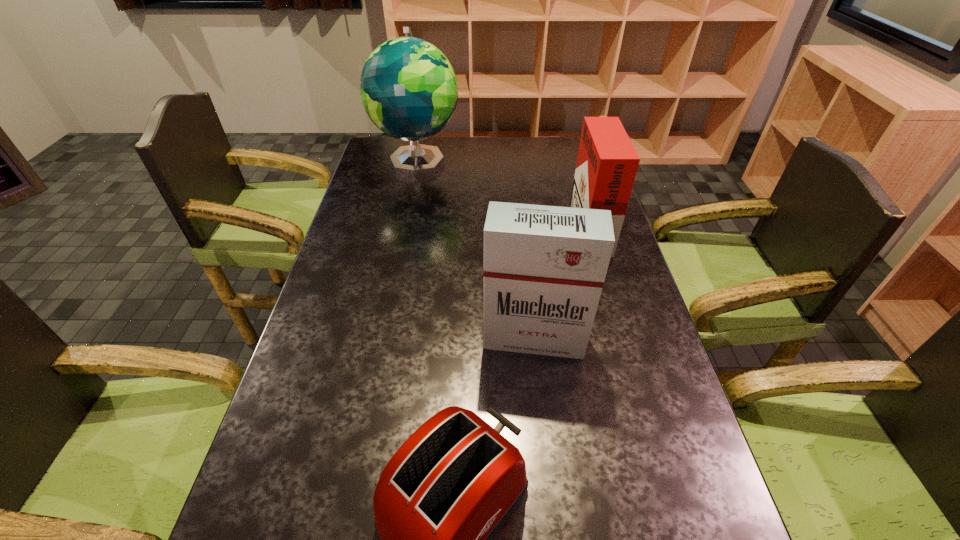
Where is `blank space located 0.240m on the front-facing side of the right cigarette case`? blank space located 0.240m on the front-facing side of the right cigarette case is located at coordinates (497, 226).

The image size is (960, 540). Identify the location of object at the far edge. (409, 90).

Image resolution: width=960 pixels, height=540 pixels. What are the coordinates of `object that is positioned at the left edge` in the screenshot? It's located at (409, 90).

Identify the location of object located in the right edge section of the desktop. (607, 163).

The image size is (960, 540). What are the coordinates of `object present at the far left corner` in the screenshot? It's located at (409, 90).

Identify the location of free space at the far edge. The image size is (960, 540). (460, 151).

In the image, there is a desktop. At what (x,y) coordinates should I click in order to perform the action: click on vacant space at the left edge. Please return your answer as a coordinate pair (x, y). The height and width of the screenshot is (540, 960). Looking at the image, I should click on (316, 341).

This screenshot has width=960, height=540. Find the location of `free space at the right edge of the desktop`. free space at the right edge of the desktop is located at coordinates (617, 421).

Image resolution: width=960 pixels, height=540 pixels. I want to click on vacant area at the far right corner of the desktop, so click(561, 163).

Locate an element on the screen. The height and width of the screenshot is (540, 960). vacant region between the second nearest object and the tallest object is located at coordinates (476, 249).